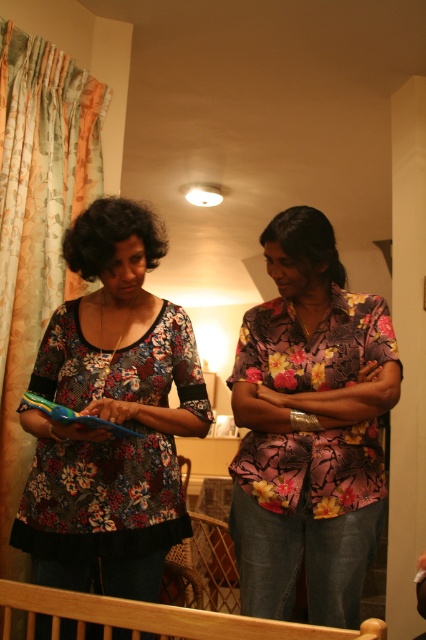
You are standing in the room and want to hang a new curtain. The existing floral fabric curtain at left is currently over the wooden balustrade at lower center. Is the curtain placed above or below the balustrade?

The floral fabric curtain at left is positioned over the wooden balustrade at lower center, so it is placed above the balustrade.

You are a fashion designer looking for fabric samples. You see the floral fabric blouse at center and the floral fabric curtain at left in the room. Which one is closer to the floor?

The floral fabric blouse at center is located below the floral fabric curtain at left, so it is closer to the floor than the curtain.